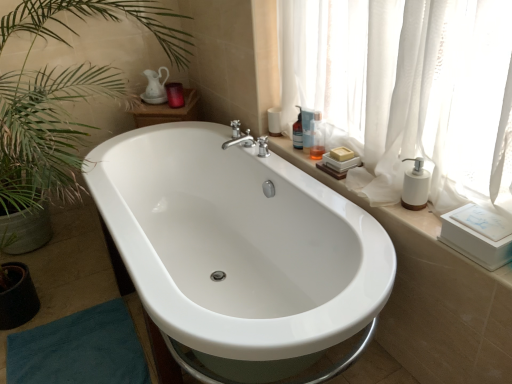
Question: Is translucent glass bottle at upper right, positioned as the 3th toiletry in front-to-back order, taller than translucent plastic bottle at upper right, acting as the third toiletry starting from the left?

Choices:
 (A) yes
 (B) no

Answer: (B)

Question: Considering the relative sizes of translucent glass bottle at upper right, marked as the 3th toiletry in a right-to-left arrangement, and translucent plastic bottle at upper right, acting as the third toiletry starting from the left, in the image provided, is translucent glass bottle at upper right, marked as the 3th toiletry in a right-to-left arrangement, wider than translucent plastic bottle at upper right, acting as the third toiletry starting from the left,?

Choices:
 (A) yes
 (B) no

Answer: (A)

Question: Is translucent glass bottle at upper right, marked as the 3th toiletry in a right-to-left arrangement, outside translucent plastic bottle at upper right, the 2th toiletry when ordered from front to back?

Choices:
 (A) no
 (B) yes

Answer: (B)

Question: Does translucent glass bottle at upper right, marked as the 3th toiletry in a right-to-left arrangement, have a smaller size compared to translucent plastic bottle at upper right, the third toiletry from the back?

Choices:
 (A) yes
 (B) no

Answer: (B)

Question: Is translucent glass bottle at upper right, the 2th toiletry positioned from the back, oriented towards translucent plastic bottle at upper right, the 2th toiletry when ordered from front to back?

Choices:
 (A) no
 (B) yes

Answer: (A)

Question: From the image's perspective, is translucent glass bottle at upper right, the 2th toiletry positioned from the back, beneath translucent plastic bottle at upper right, the 2th toiletry when ordered from front to back?

Choices:
 (A) yes
 (B) no

Answer: (B)

Question: From the image's perspective, is matte purple candle at upper center, the 4th toiletry viewed from the right, under white matte soap dispenser at right?

Choices:
 (A) no
 (B) yes

Answer: (A)

Question: Can you confirm if matte purple candle at upper center, the 4th toiletry in the front-to-back sequence, is positioned to the left of white matte soap dispenser at right?

Choices:
 (A) yes
 (B) no

Answer: (A)

Question: Can you confirm if matte purple candle at upper center, the first toiletry from the back, is shorter than white matte soap dispenser at right?

Choices:
 (A) yes
 (B) no

Answer: (A)

Question: Can you confirm if matte purple candle at upper center, the first toiletry from the back, is thinner than white matte soap dispenser at right?

Choices:
 (A) yes
 (B) no

Answer: (B)

Question: From the image's perspective, does matte purple candle at upper center, the 1th toiletry from the left, appear higher than white matte soap dispenser at right?

Choices:
 (A) no
 (B) yes

Answer: (B)

Question: Is matte purple candle at upper center, the first toiletry from the back, looking in the opposite direction of white matte soap dispenser at right?

Choices:
 (A) yes
 (B) no

Answer: (B)

Question: Considering the relative sizes of translucent plastic bottle at upper right, the 2th toiletry when ordered from front to back, and matte purple candle at upper center, the 1th toiletry from the left, in the image provided, is translucent plastic bottle at upper right, the 2th toiletry when ordered from front to back, wider than matte purple candle at upper center, the 1th toiletry from the left,?

Choices:
 (A) no
 (B) yes

Answer: (A)